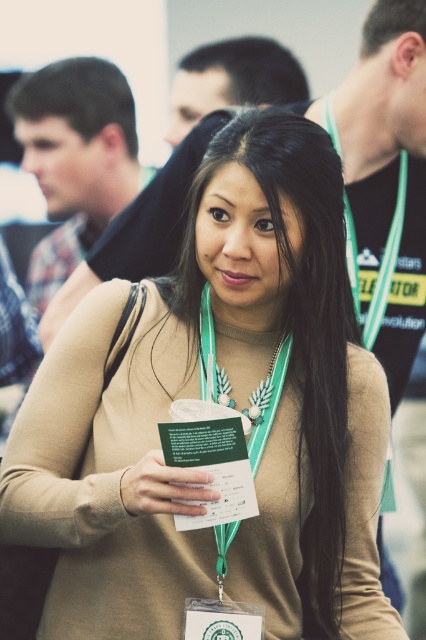
Where is `teal fabric necklace at center`? This screenshot has height=640, width=426. teal fabric necklace at center is located at coordinates pyautogui.click(x=249, y=301).

Who is more forward, (281, 300) or (339, 154)?

Positioned in front is point (281, 300).

What do you see at coordinates (249, 301) in the screenshot? I see `teal fabric necklace at center` at bounding box center [249, 301].

Where is `teal fabric necklace at center`? This screenshot has width=426, height=640. teal fabric necklace at center is located at coordinates (249, 301).

Where is `dark brown hair at upper left`? dark brown hair at upper left is located at coordinates (77, 97).

Who is more distant from viewer, (x=97, y=99) or (x=221, y=532)?

Point (x=97, y=99)

The image size is (426, 640). What are the coordinates of `dark brown hair at upper left` in the screenshot? It's located at (77, 97).

Can you confirm if teal fabric lanyard at center is wider than teal fabric necklace at center?

Correct, the width of teal fabric lanyard at center exceeds that of teal fabric necklace at center.

Is teal fabric lanyard at center further to the viewer compared to teal fabric necklace at center?

No, teal fabric lanyard at center is in front of teal fabric necklace at center.

Where is `teal fabric lanyard at center`? This screenshot has height=640, width=426. teal fabric lanyard at center is located at coordinates (267, 401).